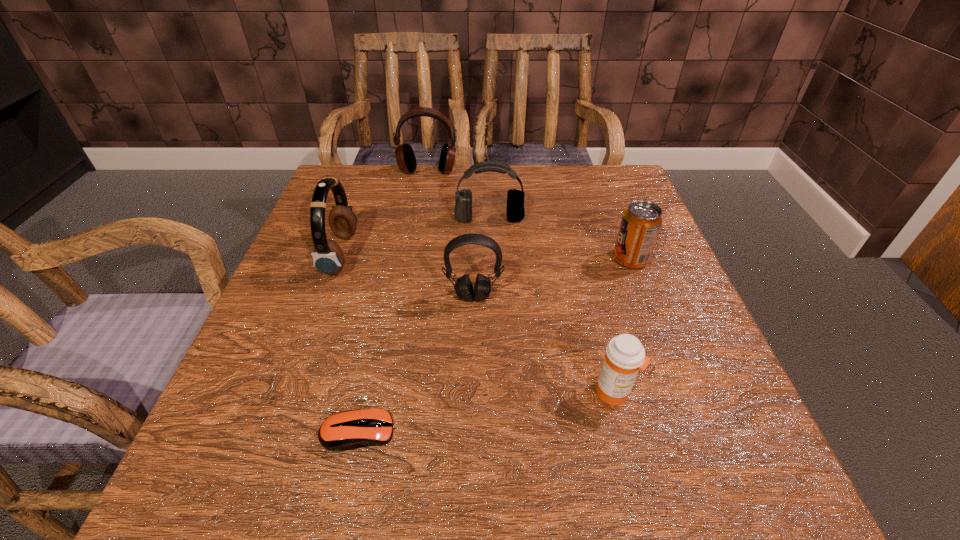
The height and width of the screenshot is (540, 960). I want to click on the farthest headset, so click(x=405, y=157).

Locate an element on the screen. the second nearest headset is located at coordinates (328, 257).

Identify the location of the leftmost headset. pos(328,257).

This screenshot has width=960, height=540. Find the location of `the second farthest object`. the second farthest object is located at coordinates (515, 211).

Locate an element on the screen. The image size is (960, 540). the fifth farthest object is located at coordinates (463, 287).

Image resolution: width=960 pixels, height=540 pixels. What are the coordinates of `soda can` in the screenshot? It's located at (641, 222).

Locate an element on the screen. The height and width of the screenshot is (540, 960). the second nearest object is located at coordinates (625, 355).

The height and width of the screenshot is (540, 960). Find the location of `the second object from right to left`. the second object from right to left is located at coordinates (625, 355).

What are the coordinates of `the nearest object` in the screenshot? It's located at (346, 430).

Identify the location of the shortest object. The width and height of the screenshot is (960, 540). (346, 430).